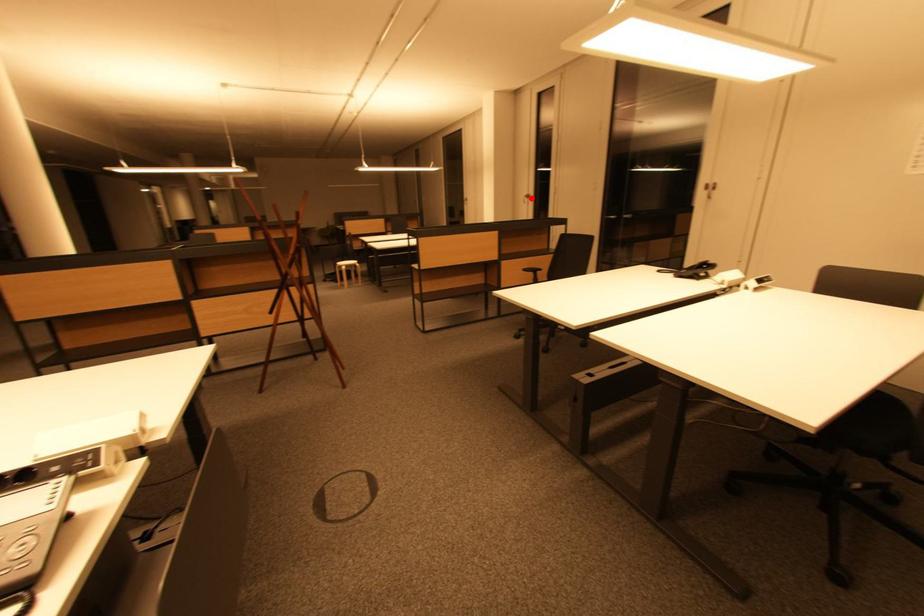
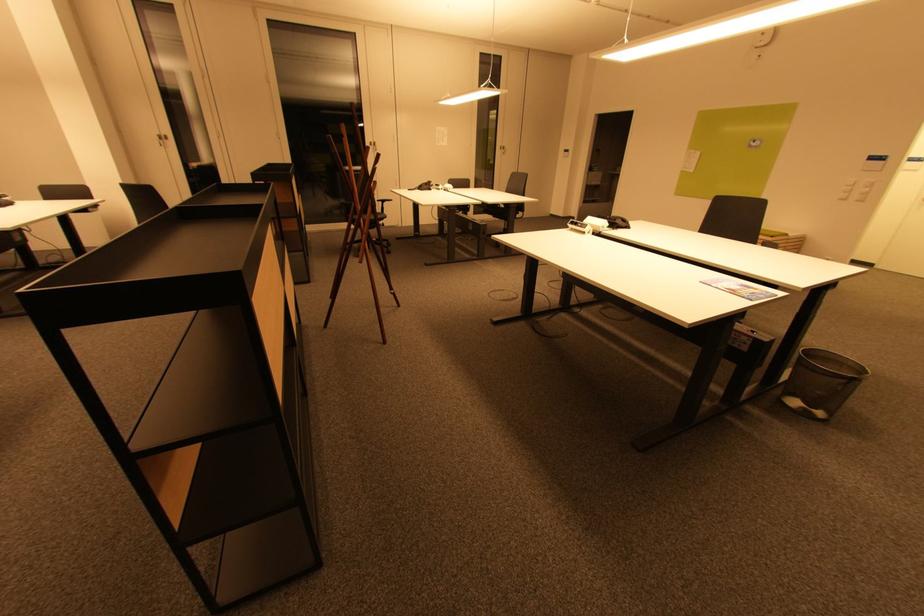
Locate, in the second image, the point that corresponds to the highlighted location in the first image.

(166, 140)